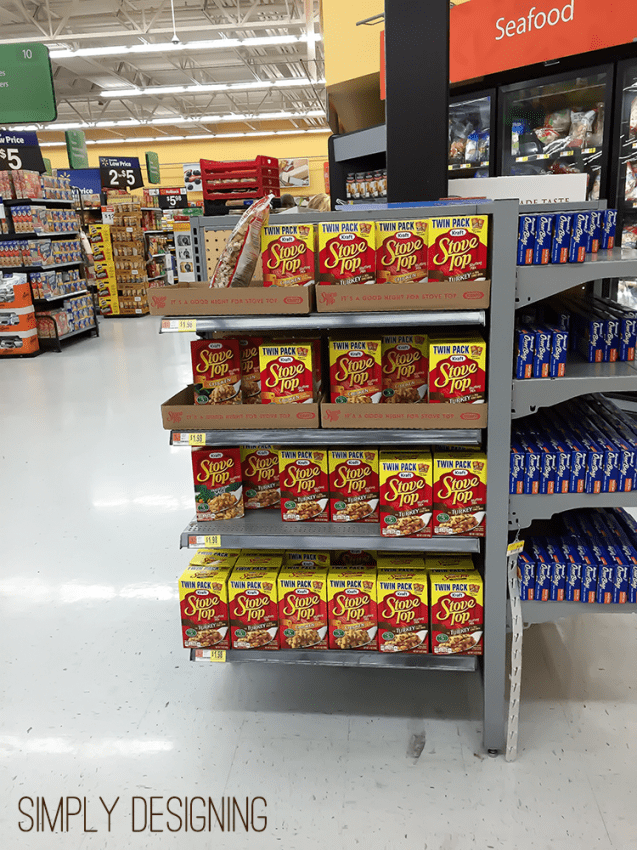
At what (x,y) coordinates should I click in order to perform the action: click on cardboard boxes. Please return your answer as a coordinate pair (x, y). Image resolution: width=637 pixels, height=850 pixels. Looking at the image, I should click on (233, 296), (376, 292), (274, 412), (392, 411).